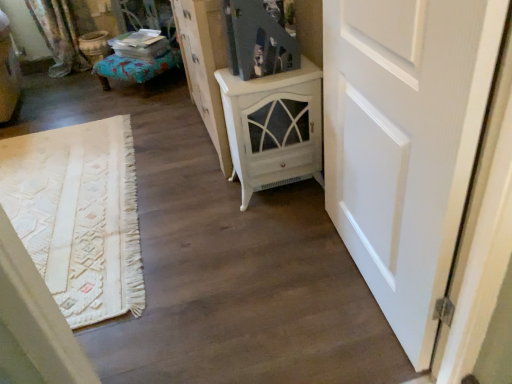
Question: From the image's perspective, is white distressed cabinet at center above textured teal ottoman at left?

Choices:
 (A) no
 (B) yes

Answer: (A)

Question: From the image's perspective, is white distressed cabinet at center located beneath textured teal ottoman at left?

Choices:
 (A) yes
 (B) no

Answer: (A)

Question: Can you confirm if white distressed cabinet at center is positioned to the right of textured teal ottoman at left?

Choices:
 (A) yes
 (B) no

Answer: (A)

Question: Is white distressed cabinet at center outside of textured teal ottoman at left?

Choices:
 (A) no
 (B) yes

Answer: (B)

Question: Does white distressed cabinet at center have a greater width compared to textured teal ottoman at left?

Choices:
 (A) no
 (B) yes

Answer: (A)

Question: Does white distressed cabinet at center come behind textured teal ottoman at left?

Choices:
 (A) no
 (B) yes

Answer: (A)

Question: Is textured teal ottoman at left at the back of white matte door at right?

Choices:
 (A) no
 (B) yes

Answer: (A)

Question: Considering the relative positions of white matte door at right and textured teal ottoman at left in the image provided, is white matte door at right to the left of textured teal ottoman at left from the viewer's perspective?

Choices:
 (A) yes
 (B) no

Answer: (B)

Question: From a real-world perspective, is white matte door at right under textured teal ottoman at left?

Choices:
 (A) yes
 (B) no

Answer: (B)

Question: From the image's perspective, is white matte door at right located above textured teal ottoman at left?

Choices:
 (A) no
 (B) yes

Answer: (A)

Question: Considering the relative sizes of white matte door at right and textured teal ottoman at left in the image provided, is white matte door at right taller than textured teal ottoman at left?

Choices:
 (A) no
 (B) yes

Answer: (B)

Question: Are white matte door at right and textured teal ottoman at left located far from each other?

Choices:
 (A) no
 (B) yes

Answer: (B)

Question: Is white painted wood cabinet at center in contact with white distressed cabinet at center?

Choices:
 (A) yes
 (B) no

Answer: (B)